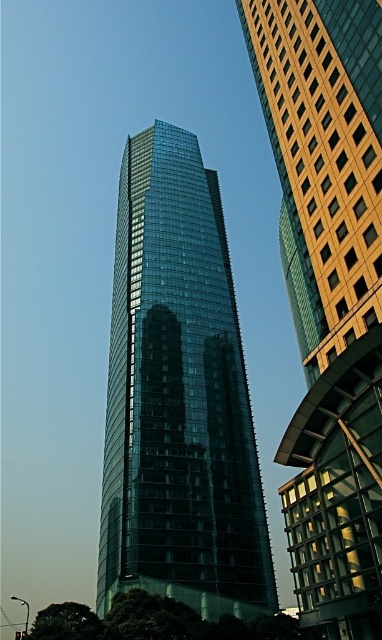
Where is `transparent glass tower at center`? transparent glass tower at center is located at coordinates (179, 397).

Does transparent glass tower at center have a greater height compared to shiny glass skyscraper at center?

Yes, transparent glass tower at center is taller than shiny glass skyscraper at center.

In the scene shown: Who is more distant from viewer, (263, 556) or (284, 1)?

The point (263, 556) is more distant.

Where is `transparent glass tower at center`? The width and height of the screenshot is (382, 640). transparent glass tower at center is located at coordinates (179, 397).